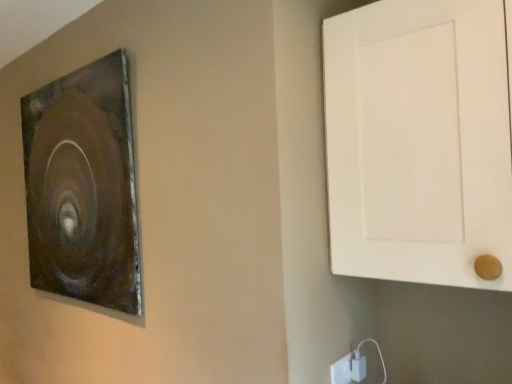
Question: From a real-world perspective, is white matte door at right located beneath metallic brown picture frame at upper left?

Choices:
 (A) no
 (B) yes

Answer: (A)

Question: Does white matte door at right have a smaller size compared to metallic brown picture frame at upper left?

Choices:
 (A) yes
 (B) no

Answer: (B)

Question: From the image's perspective, would you say white matte door at right is positioned over metallic brown picture frame at upper left?

Choices:
 (A) no
 (B) yes

Answer: (B)

Question: Is the depth of white matte door at right less than that of metallic brown picture frame at upper left?

Choices:
 (A) no
 (B) yes

Answer: (B)

Question: Would you say white matte door at right is a long distance from metallic brown picture frame at upper left?

Choices:
 (A) yes
 (B) no

Answer: (B)

Question: Considering the relative positions of white matte door at right and white plastic electric outlet at lower right in the image provided, is white matte door at right to the left or to the right of white plastic electric outlet at lower right?

Choices:
 (A) left
 (B) right

Answer: (B)

Question: Considering their positions, is white matte door at right located in front of or behind white plastic electric outlet at lower right?

Choices:
 (A) front
 (B) behind

Answer: (A)

Question: In terms of width, does white matte door at right look wider or thinner when compared to white plastic electric outlet at lower right?

Choices:
 (A) wide
 (B) thin

Answer: (A)

Question: From a real-world perspective, relative to white plastic electric outlet at lower right, is white matte door at right vertically above or below?

Choices:
 (A) above
 (B) below

Answer: (A)

Question: From a real-world perspective, relative to white matte door at right, is white plastic electric outlet at lower right vertically above or below?

Choices:
 (A) below
 (B) above

Answer: (A)

Question: From the image's perspective, is white plastic electric outlet at lower right above or below white matte door at right?

Choices:
 (A) below
 (B) above

Answer: (A)

Question: Is white plastic electric outlet at lower right inside or outside of white matte door at right?

Choices:
 (A) outside
 (B) inside

Answer: (A)

Question: Is point (332, 365) closer or farther from the camera than point (348, 178)?

Choices:
 (A) farther
 (B) closer

Answer: (A)

Question: In terms of size, does metallic brown picture frame at upper left appear bigger or smaller than white matte door at right?

Choices:
 (A) small
 (B) big

Answer: (A)

Question: In the image, is metallic brown picture frame at upper left positioned in front of or behind white matte door at right?

Choices:
 (A) behind
 (B) front

Answer: (A)